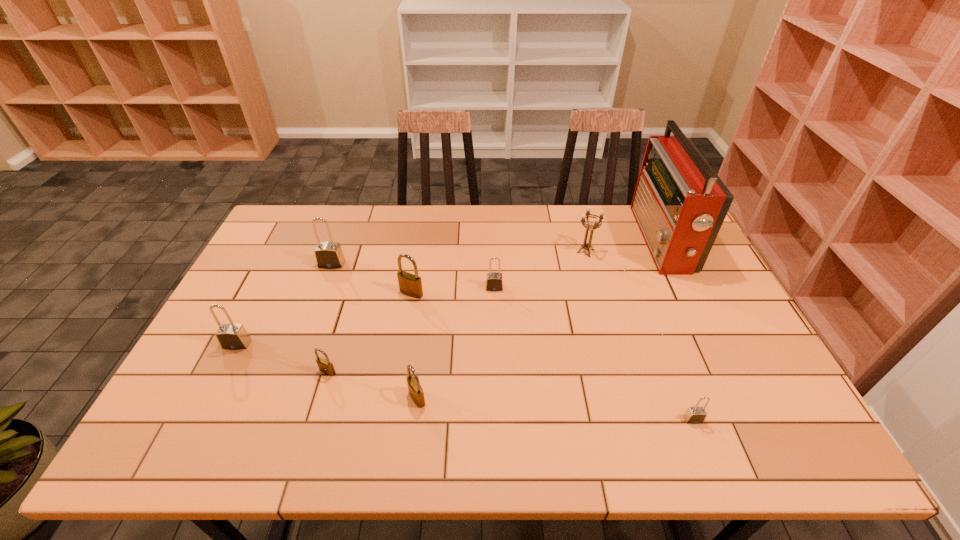
Where is `free space between the leftmost object and the farthest brass padlock`? Image resolution: width=960 pixels, height=540 pixels. free space between the leftmost object and the farthest brass padlock is located at coordinates (324, 319).

The height and width of the screenshot is (540, 960). I want to click on unoccupied area between the biggest brass padlock and the rightmost padlock, so click(x=552, y=356).

Where is `vacant space in between the second nearest object and the biggest brass padlock`? The image size is (960, 540). vacant space in between the second nearest object and the biggest brass padlock is located at coordinates (414, 346).

I want to click on empty space between the seventh object from left to right and the second nearest gray padlock, so click(412, 298).

What are the coordinates of `free space between the tallest object and the biggest gray padlock` in the screenshot? It's located at (496, 252).

Locate an element on the screen. The height and width of the screenshot is (540, 960). vacant area that lies between the fifth padlock from right to left and the rightmost object is located at coordinates (494, 306).

What are the coordinates of `vacant area between the rightmost padlock and the biggest brass padlock` in the screenshot? It's located at (552, 356).

Identify the location of vacant space in between the farthest brass padlock and the nearest padlock. (552, 356).

Identify which object is the sixth nearest to the radio receiver. Please provide its 2D coordinates. Your answer should be formatted as a tuple, i.e. [(x, y)], where the tuple contains the x and y coordinates of a point satisfying the conditions above.

[(325, 366)]

Identify which object is located as the seventh nearest to the seventh farthest object. Please provide its 2D coordinates. Your answer should be formatted as a tuple, i.e. [(x, y)], where the tuple contains the x and y coordinates of a point satisfying the conditions above.

[(694, 415)]